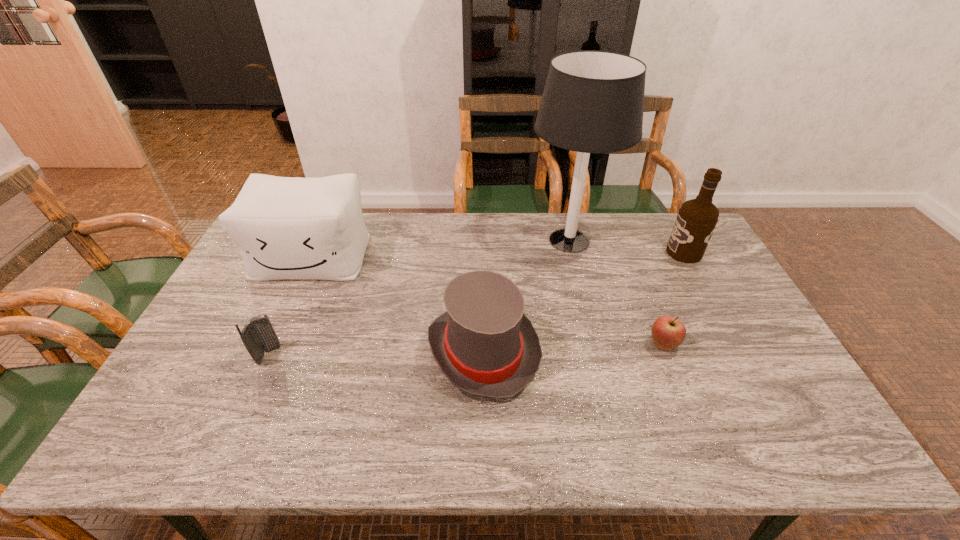
Where is `vacant area that lies between the shortest object and the tallest object`? The height and width of the screenshot is (540, 960). vacant area that lies between the shortest object and the tallest object is located at coordinates (616, 293).

This screenshot has height=540, width=960. I want to click on unoccupied position between the shortest object and the tallest object, so click(x=616, y=293).

This screenshot has width=960, height=540. I want to click on vacant space that's between the tallest object and the apple, so click(x=616, y=293).

Where is `object that stands as the fifth closest to the alcohol`? The image size is (960, 540). object that stands as the fifth closest to the alcohol is located at coordinates (258, 336).

Locate which object is the closest to the cellular telephone. Please provide its 2D coordinates. Your answer should be formatted as a tuple, i.e. [(x, y)], where the tuple contains the x and y coordinates of a point satisfying the conditions above.

[(286, 227)]

Identify the location of free space that satisfies the following two spatial constraints: 1. on the front side of the tallest object; 2. on the keyboard of the fifth tallest object. (597, 355).